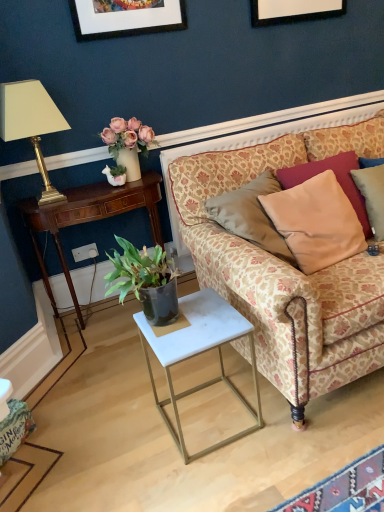
At what (x,y) coordinates should I click in order to perform the action: click on vacant space in white marble table at lower center (from a real-world perspective). Please return your answer as a coordinate pair (x, y). This screenshot has width=384, height=512. Looking at the image, I should click on pyautogui.click(x=210, y=417).